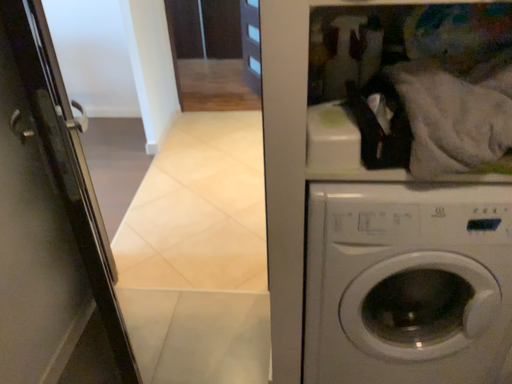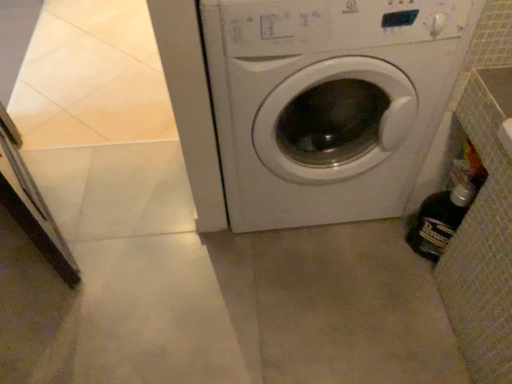
Question: How did the camera likely rotate when shooting the video?

Choices:
 (A) rotated right
 (B) rotated left

Answer: (A)